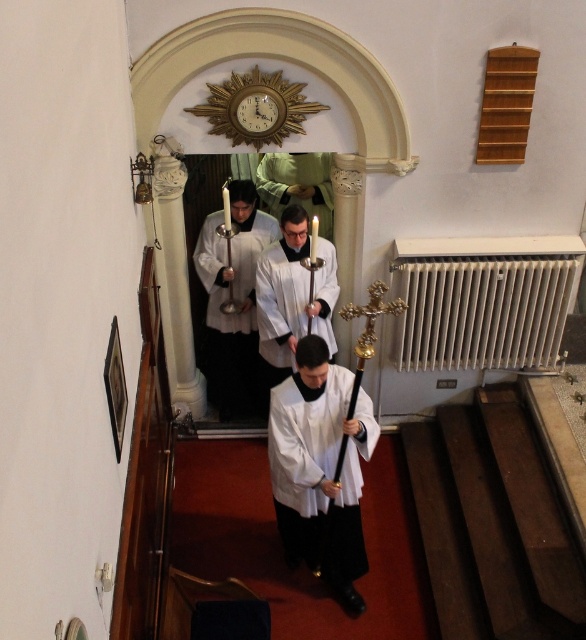
Does white metallic radiator at right come behind white matte vestment at center?

That is True.

Who is higher up, white metallic radiator at right or white matte vestment at center?

white metallic radiator at right

Locate an element on the screen. Image resolution: width=586 pixels, height=640 pixels. white metallic radiator at right is located at coordinates (483, 300).

Can you confirm if white metallic radiator at right is shorter than white matte/soft fabric at center?

Yes.

Consider the image. Can you confirm if white metallic radiator at right is smaller than white matte/soft fabric at center?

Indeed, white metallic radiator at right has a smaller size compared to white matte/soft fabric at center.

Who is more distant from viewer, [449,348] or [316,500]?

Point [449,348]

Image resolution: width=586 pixels, height=640 pixels. I want to click on white metallic radiator at right, so click(x=483, y=300).

Measure the distance between white matte/soft fabric at center and white glossy robe at center.

The distance of white matte/soft fabric at center from white glossy robe at center is 4.47 feet.

Between white matte/soft fabric at center and white glossy robe at center, which one has less height?

white matte/soft fabric at center is shorter.

You are a GUI agent. You are given a task and a screenshot of the screen. Output one action in this format:
    pyautogui.click(x=<x>, y=<y>)
    Task: Click on the white matte/soft fabric at center
    
    Given the screenshot: What is the action you would take?
    pyautogui.click(x=319, y=467)